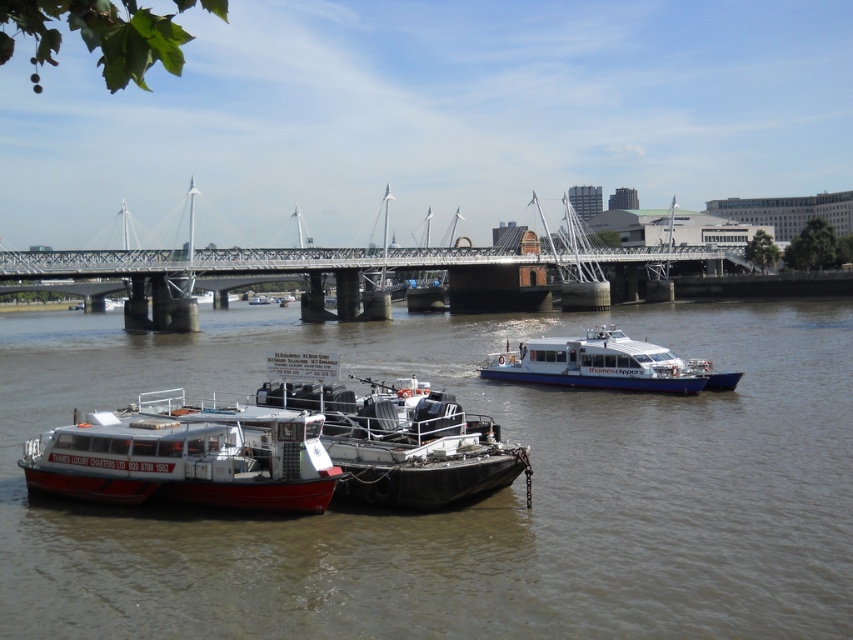
Question: Which object is the farthest from the brown matte water at center?

Choices:
 (A) white matte boat at lower left
 (B) white glossy ferry boat at center

Answer: (A)

Question: Does metallic bridge at center appear on the left side of white glossy ferry boat at center?

Choices:
 (A) no
 (B) yes

Answer: (B)

Question: Can you confirm if white matte boat at lower left is smaller than white glossy ferry boat at center?

Choices:
 (A) yes
 (B) no

Answer: (A)

Question: Which point is closer to the camera taking this photo?

Choices:
 (A) (218, 497)
 (B) (550, 364)

Answer: (A)

Question: Observing the image, what is the correct spatial positioning of white matte boat at lower left in reference to white glossy ferry boat at center?

Choices:
 (A) below
 (B) above

Answer: (A)

Question: Among these points, which one is farthest from the camera?

Choices:
 (A) (573, 356)
 (B) (259, 253)

Answer: (B)